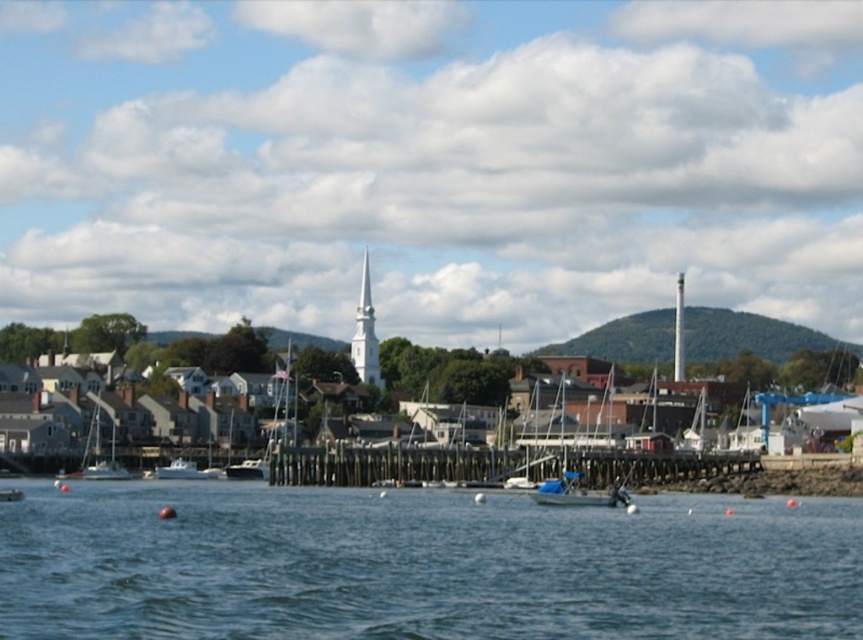
You are standing at the waterfront and want to know how far the point at coordinates [533,538] is from you. Can you determine the distance?

The distance of point [533,538] from the viewer is 70.57 meters.

You are a photographer standing on the wooden pier and want to capture both the white smooth spire at center and the white matte boat at center in the same frame. Given that your camera has a 50mm lens which has a field of view that can cover a maximum distance of 350 feet between objects, will you be able to include both in the photo?

The white smooth spire at center and white matte boat at center are 355.53 feet apart. Since the maximum distance your camera can cover is 350 feet, you will not be able to include both in the same frame.

You are a photographer planning to capture the waterfront scene. You want to position your camera so that the blue fabric boat at center and the white smooth spire at upper center are both in the frame. Based on their positions, which object should you place on the left side of your photo?

The blue fabric boat at center should be placed on the left side of the photo because it is positioned to the left of the white smooth spire at upper center according to the description.